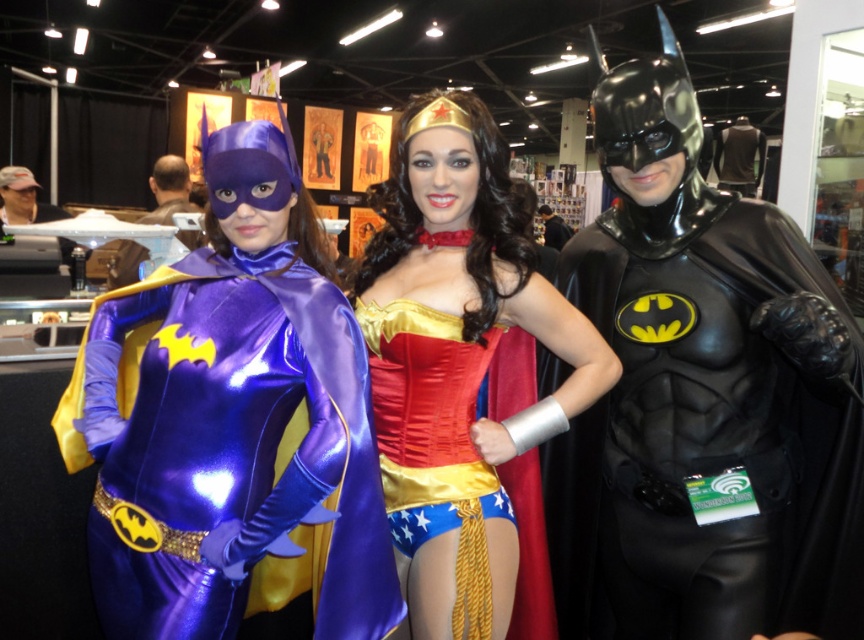
Who is positioned more to the left, shiny purple costume at left or satin gold corset at center?

From the viewer's perspective, shiny purple costume at left appears more on the left side.

Does shiny purple costume at left have a greater height compared to satin gold corset at center?

In fact, shiny purple costume at left may be shorter than satin gold corset at center.

Measure the distance between point (115,296) and camera.

The distance of point (115,296) from camera is 1.46 meters.

Locate an element on the screen. The image size is (864, 640). shiny purple costume at left is located at coordinates (232, 445).

Locate an element on the screen. The image size is (864, 640). black glossy batman costume at right is located at coordinates (702, 397).

From the picture: Is black glossy batman costume at right to the right of shiny purple costume at left from the viewer's perspective?

Yes, black glossy batman costume at right is to the right of shiny purple costume at left.

This screenshot has height=640, width=864. Identify the location of black glossy batman costume at right. (702, 397).

Can you confirm if black glossy batman costume at right is positioned below satin gold corset at center?

Indeed, black glossy batman costume at right is positioned under satin gold corset at center.

Who is more forward, (696,266) or (437,582)?

Point (437,582) is more forward.

Locate an element on the screen. black glossy batman costume at right is located at coordinates (702, 397).